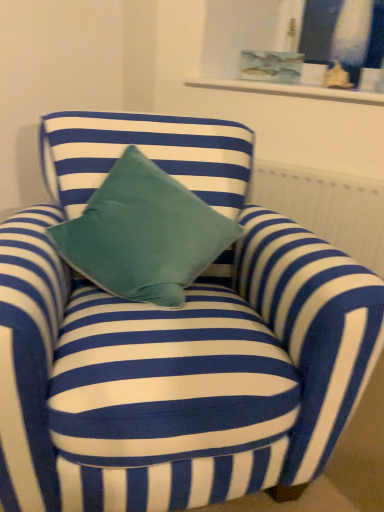
Question: Is the depth of white textured radiator at upper center greater than that of matte glass vase at upper right?

Choices:
 (A) no
 (B) yes

Answer: (A)

Question: Is white textured radiator at upper center thinner than matte glass vase at upper right?

Choices:
 (A) no
 (B) yes

Answer: (A)

Question: Is white textured radiator at upper center positioned beyond the bounds of matte glass vase at upper right?

Choices:
 (A) yes
 (B) no

Answer: (A)

Question: Can you confirm if white textured radiator at upper center is wider than matte glass vase at upper right?

Choices:
 (A) yes
 (B) no

Answer: (A)

Question: Are white textured radiator at upper center and matte glass vase at upper right making contact?

Choices:
 (A) yes
 (B) no

Answer: (B)

Question: Is white textured radiator at upper center taller than matte glass vase at upper right?

Choices:
 (A) yes
 (B) no

Answer: (A)

Question: Considering the relative positions of matte glass vase at upper right and white textured radiator at upper center in the image provided, is matte glass vase at upper right to the left of white textured radiator at upper center from the viewer's perspective?

Choices:
 (A) no
 (B) yes

Answer: (A)

Question: From a real-world perspective, is matte glass vase at upper right positioned over white textured radiator at upper center based on gravity?

Choices:
 (A) no
 (B) yes

Answer: (B)

Question: Is matte glass vase at upper right turned away from white textured radiator at upper center?

Choices:
 (A) yes
 (B) no

Answer: (B)

Question: Can you confirm if matte glass vase at upper right is wider than white textured radiator at upper center?

Choices:
 (A) no
 (B) yes

Answer: (A)

Question: Is matte glass vase at upper right smaller than white textured radiator at upper center?

Choices:
 (A) no
 (B) yes

Answer: (B)

Question: Considering the relative sizes of matte glass vase at upper right and white textured radiator at upper center in the image provided, is matte glass vase at upper right taller than white textured radiator at upper center?

Choices:
 (A) no
 (B) yes

Answer: (A)

Question: Considering their positions, is white textured radiator at upper center located in front of or behind matte glass vase at upper right?

Choices:
 (A) behind
 (B) front

Answer: (B)